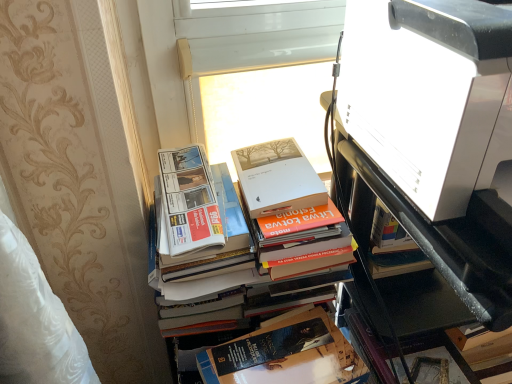
I want to click on hardcover book at center, so coord(285,356).

This screenshot has width=512, height=384. Find the location of `white glossy printer at upper right`. white glossy printer at upper right is located at coordinates (424, 247).

Find the location of a particular element. This screenshot has width=512, height=384. white glossy printer at upper right is located at coordinates point(429,95).

This screenshot has width=512, height=384. I want to click on hardcover book at center, so click(285, 356).

Does hardcover book at center come behind white glossy printer at upper right?

Yes, hardcover book at center is further from the viewer.

Is hardcover book at center located outside white glossy printer at upper right?

Indeed, hardcover book at center is completely outside white glossy printer at upper right.

Identify the location of printer that is above the hardcover book at center (from a real-world perspective). (429, 95).

Does point (298, 151) come behind point (347, 34)?

Yes, it is.

Is point (241, 163) closer or farther from the camera than point (296, 14)?

Point (241, 163) appears to be closer to the viewer than point (296, 14).

From their relative heights in the image, would you say hardcover book at center is taller or shorter than white plastic window screen at upper center?

In the image, hardcover book at center appears to be taller than white plastic window screen at upper center.

Choose the correct answer: Is hardcover book at center inside white plastic window screen at upper center or outside it?

The correct answer is: outside.

Is white plastic window screen at upper center to the left of white glossy printer at upper right from the viewer's perspective?

Indeed, white plastic window screen at upper center is positioned on the left side of white glossy printer at upper right.

From the image's perspective, which is below, white plastic window screen at upper center or white glossy printer at upper right?

white glossy printer at upper right appears lower in the image.

Between white plastic window screen at upper center and white glossy printer at upper right, which one has smaller size?

Smaller between the two is white plastic window screen at upper center.

Could you tell me if white plastic window screen at upper center is turned towards white glossy printer at upper right?

Yes, white plastic window screen at upper center is oriented towards white glossy printer at upper right.

Which object is closer to the camera, white plastic window screen at upper center or white glossy printer at upper right?

Positioned in front is white glossy printer at upper right.

From the image's perspective, which one is positioned lower, white plastic window screen at upper center or white glossy printer at upper right?

white glossy printer at upper right is shown below in the image.

Considering the sizes of hardcover book at center and white glossy printer at upper right in the image, is hardcover book at center taller or shorter than white glossy printer at upper right?

In the image, hardcover book at center appears to be shorter than white glossy printer at upper right.

Is hardcover book at center next to white glossy printer at upper right?

No, hardcover book at center is not next to white glossy printer at upper right.

Looking at this image, who is more distant, hardcover book at center or white glossy printer at upper right?

hardcover book at center is behind.

From the image's perspective, between hardcover book at center and white glossy printer at upper right, who is located below?

white glossy printer at upper right.

Is white plastic window screen at upper center at the back of white glossy printer at upper right?

Yes, white plastic window screen at upper center is at the back of white glossy printer at upper right.

Considering the sizes of objects white glossy printer at upper right and white plastic window screen at upper center in the image provided, who is bigger, white glossy printer at upper right or white plastic window screen at upper center?

With larger size is white glossy printer at upper right.

Based on the photo, from a real-world perspective, between white glossy printer at upper right and white plastic window screen at upper center, who is vertically higher?

In real-world perspective, white glossy printer at upper right is above.

Does white glossy printer at upper right appear on the right side of white plastic window screen at upper center?

Indeed, white glossy printer at upper right is positioned on the right side of white plastic window screen at upper center.

How many degrees apart are the facing directions of white plastic window screen at upper center and hardcover book at center?

The facing directions of white plastic window screen at upper center and hardcover book at center are 5.88 degrees apart.

Between white plastic window screen at upper center and hardcover book at center, which one has larger size?

hardcover book at center.

From the image's perspective, is white plastic window screen at upper center beneath hardcover book at center?

Incorrect, from the image's perspective, white plastic window screen at upper center is higher than hardcover book at center.

Find the location of a particular element. The height and width of the screenshot is (384, 512). book that appears below the white glossy printer at upper right (from a real-world perspective) is located at coordinates (285, 356).

At what (x,y) coordinates should I click in order to perform the action: click on window screen that is on the right side of hardcover book at center. Please return your answer as a coordinate pair (x, y). The width and height of the screenshot is (512, 384). Looking at the image, I should click on (258, 72).

Looking at the image, which one is located further to white glossy printer at upper right, white glossy printer at upper right or white plastic window screen at upper center?

white plastic window screen at upper center is positioned further to the anchor white glossy printer at upper right.

Considering their positions, is white plastic window screen at upper center positioned closer to hardcover book at center than white glossy printer at upper right?

Based on the image, white glossy printer at upper right appears to be nearer to hardcover book at center.

Based on their spatial positions, is white glossy printer at upper right or hardcover book at center further from white glossy printer at upper right?

Among the two, hardcover book at center is located further to white glossy printer at upper right.

Which object lies further to the anchor point white glossy printer at upper right, white plastic window screen at upper center or white glossy printer at upper right?

The object further to white glossy printer at upper right is white plastic window screen at upper center.

Which object lies nearer to the anchor point white plastic window screen at upper center, white glossy printer at upper right or white glossy printer at upper right?

white glossy printer at upper right is positioned closer to the anchor white plastic window screen at upper center.

When comparing their distances from white plastic window screen at upper center, does hardcover book at center or white glossy printer at upper right seem closer?

hardcover book at center is closer to white plastic window screen at upper center.

Based on their spatial positions, is white glossy printer at upper right or hardcover book at center further from white glossy printer at upper right?

Among the two, hardcover book at center is located further to white glossy printer at upper right.

Considering their positions, is white plastic window screen at upper center positioned further to hardcover book at center than white glossy printer at upper right?

Among the two, white glossy printer at upper right is located further to hardcover book at center.

At what (x,y) coordinates should I click in order to perform the action: click on printer situated between white plastic window screen at upper center and white glossy printer at upper right from left to right. Please return your answer as a coordinate pair (x, y). The image size is (512, 384). Looking at the image, I should click on (429, 95).

Find the location of a particular element. The height and width of the screenshot is (384, 512). window screen between hardcover book at center and white glossy printer at upper right is located at coordinates (258, 72).

At what (x,y) coordinates should I click in order to perform the action: click on book between white glossy printer at upper right and white plastic window screen at upper center along the z-axis. Please return your answer as a coordinate pair (x, y). Image resolution: width=512 pixels, height=384 pixels. Looking at the image, I should click on (285, 356).

Identify the location of printer between hardcover book at center and white glossy printer at upper right from left to right. The width and height of the screenshot is (512, 384). (429, 95).